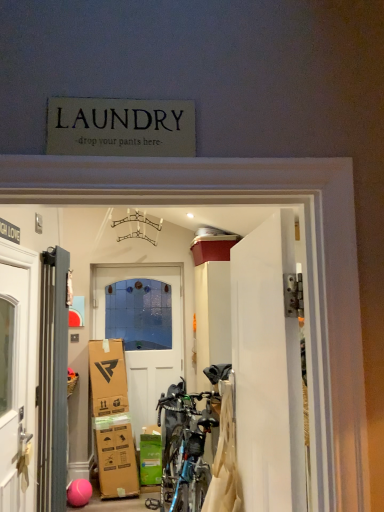
Question: Which direction should I rotate to face white glossy door at center, positioned as the first door in right-to-left order, — up or down?

Choices:
 (A) up
 (B) down

Answer: (B)

Question: Is white glossy door at center, the third door from the back, shorter than green cardboard box at lower center?

Choices:
 (A) yes
 (B) no

Answer: (B)

Question: From a real-world perspective, is white glossy door at center, positioned as the first door in right-to-left order, physically above green cardboard box at lower center?

Choices:
 (A) yes
 (B) no

Answer: (A)

Question: Is white glossy door at center, placed as the 3th door when sorted from left to right, positioned with its back to green cardboard box at lower center?

Choices:
 (A) no
 (B) yes

Answer: (A)

Question: From a real-world perspective, is white glossy door at center, which ranks as the first door in front-to-back order, physically below green cardboard box at lower center?

Choices:
 (A) no
 (B) yes

Answer: (A)

Question: Is white glossy door at center, which ranks as the first door in front-to-back order, aimed at green cardboard box at lower center?

Choices:
 (A) yes
 (B) no

Answer: (B)

Question: Considering the relative sizes of white glossy door at center, the third door from the back, and green cardboard box at lower center in the image provided, is white glossy door at center, the third door from the back, bigger than green cardboard box at lower center?

Choices:
 (A) yes
 (B) no

Answer: (A)

Question: From a real-world perspective, is metallic gray radiator at left, placed as the 2th door when sorted from front to back, positioned over white glossy door at center, positioned as the first door in right-to-left order, based on gravity?

Choices:
 (A) yes
 (B) no

Answer: (B)

Question: Is metallic gray radiator at left, the third door when ordered from right to left, oriented away from white glossy door at center, placed as the 3th door when sorted from left to right?

Choices:
 (A) no
 (B) yes

Answer: (A)

Question: Is metallic gray radiator at left, the third door when ordered from right to left, to the right of white glossy door at center, positioned as the first door in right-to-left order, from the viewer's perspective?

Choices:
 (A) yes
 (B) no

Answer: (B)

Question: Would you say metallic gray radiator at left, placed as the 2th door when sorted from front to back, is outside white glossy door at center, which ranks as the first door in front-to-back order?

Choices:
 (A) no
 (B) yes

Answer: (B)

Question: Is metallic gray radiator at left, positioned as the 2th door in back-to-front order, next to white glossy door at center, positioned as the first door in right-to-left order?

Choices:
 (A) yes
 (B) no

Answer: (B)

Question: From the image's perspective, would you say metallic gray radiator at left, the third door when ordered from right to left, is positioned over white glossy door at center, the third door from the back?

Choices:
 (A) yes
 (B) no

Answer: (B)

Question: Is metallic gray radiator at left, the third door when ordered from right to left, closer to the viewer compared to green cardboard box at lower center?

Choices:
 (A) no
 (B) yes

Answer: (B)